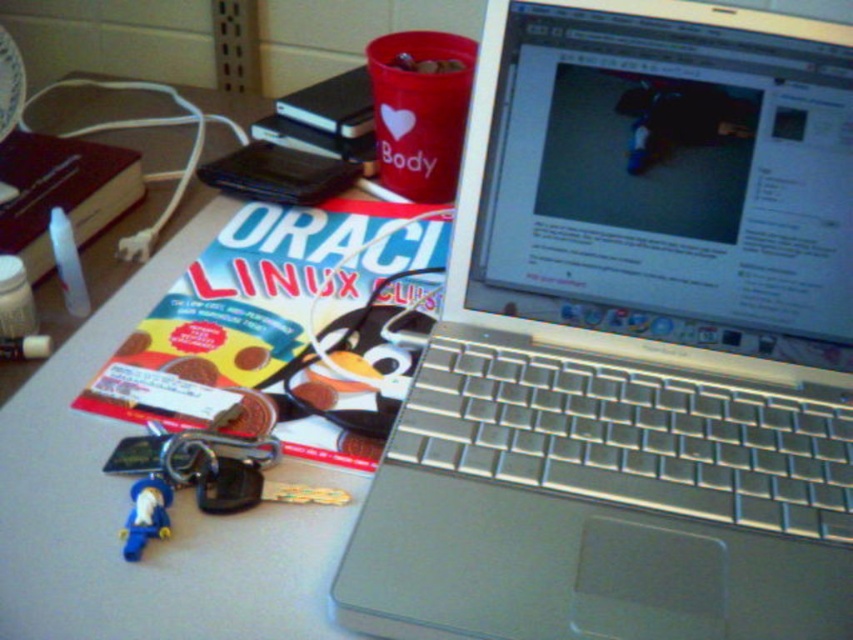
Which is above, silver metallic laptop at center or blue plastic toy at lower left?

Positioned higher is silver metallic laptop at center.

Between silver metallic laptop at center and blue plastic toy at lower left, which one is positioned lower?

blue plastic toy at lower left is lower down.

Describe the element at coordinates (631, 342) in the screenshot. The image size is (853, 640). I see `silver metallic laptop at center` at that location.

Identify the location of silver metallic laptop at center. (631, 342).